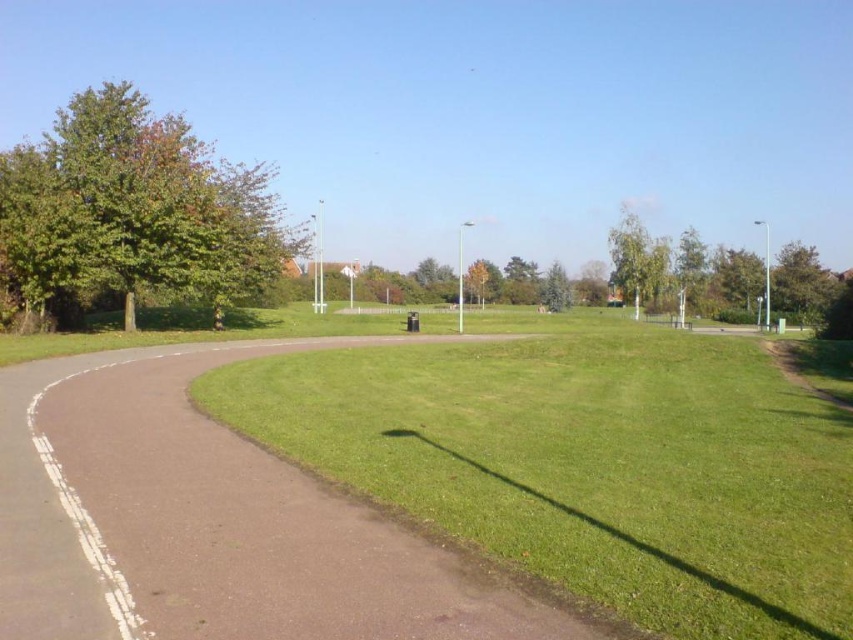
Locate an element on the screen. The width and height of the screenshot is (853, 640). green leafy tree at left is located at coordinates [134, 209].

Which is in front, point (105, 204) or point (798, 288)?

Point (105, 204) is more forward.

Does point (33, 296) lie behind point (817, 260)?

No, (33, 296) is in front of (817, 260).

The image size is (853, 640). I want to click on green leafy tree at left, so click(x=134, y=209).

Who is lower down, green grassy at center or green leafy tree at upper center?

green grassy at center

At what (x,y) coordinates should I click in order to perform the action: click on green grassy at center. Please return your answer as a coordinate pair (x, y). This screenshot has height=640, width=853. Looking at the image, I should click on (590, 465).

Can you confirm if brown asphalt path at center is positioned below green leafy tree at upper right?

Correct, brown asphalt path at center is located below green leafy tree at upper right.

Which is more to the right, brown asphalt path at center or green leafy tree at upper right?

green leafy tree at upper right

Does point (177, 461) lie in front of point (790, 268)?

Yes.

In order to click on brown asphalt path at center in this screenshot , I will do `click(210, 522)`.